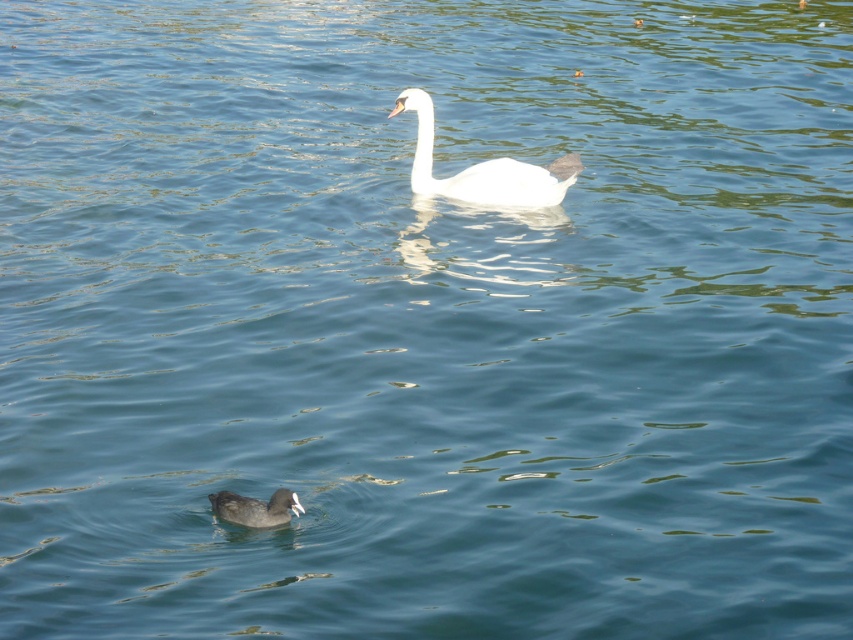
Can you confirm if white glossy swan at upper center is taller than dark brown matte duck at lower left?

Correct, white glossy swan at upper center is much taller as dark brown matte duck at lower left.

Find the location of `white glossy swan at upper center`. white glossy swan at upper center is located at coordinates (485, 168).

Find the location of a particular element. white glossy swan at upper center is located at coordinates (485, 168).